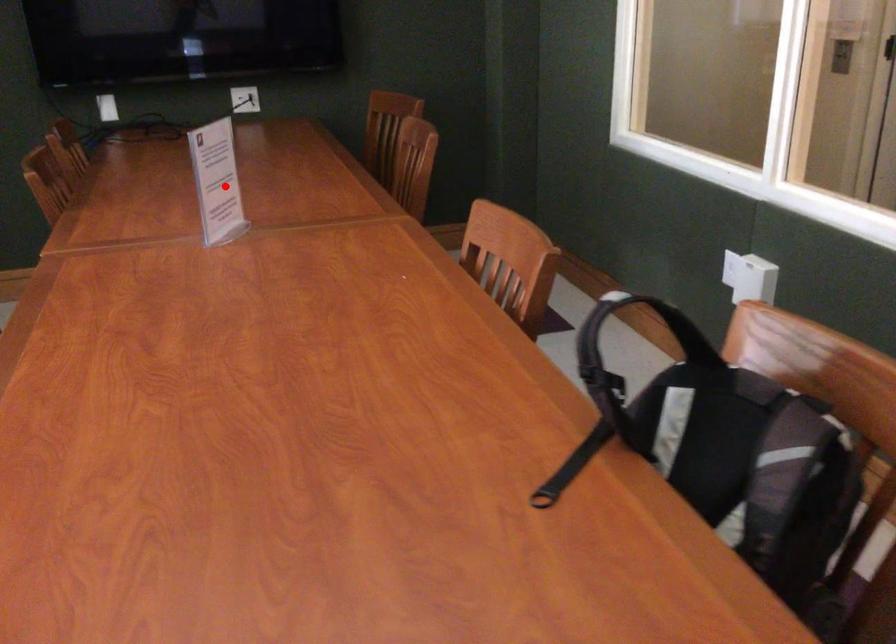
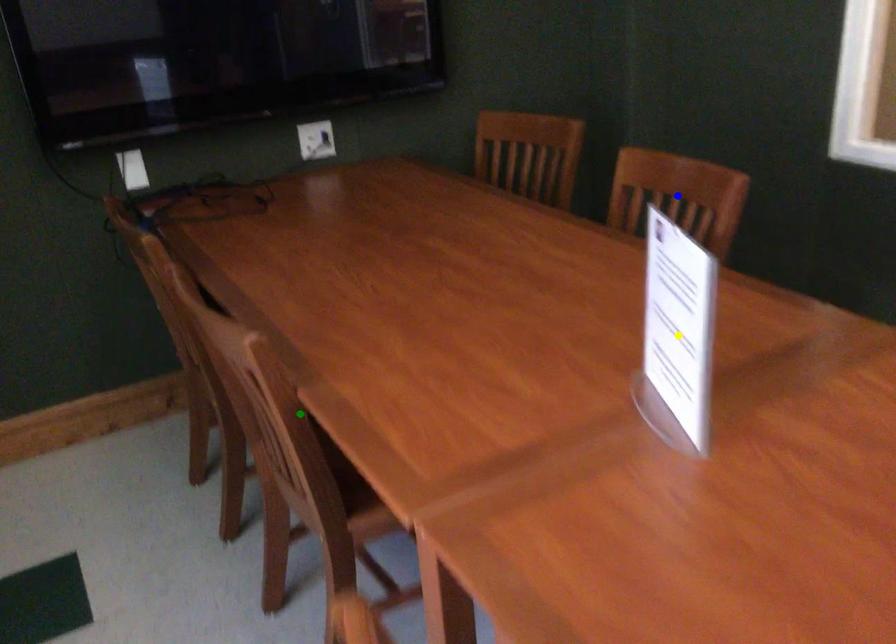
Question: I am providing you with two images of the same scene from different viewpoints. A red point is marked on the first image. You are given multiple points on the second image. Which point in image 2 is actually the same real-world point as the red point in image 1?

Choices:
 (A) blue point
 (B) green point
 (C) yellow point

Answer: (C)